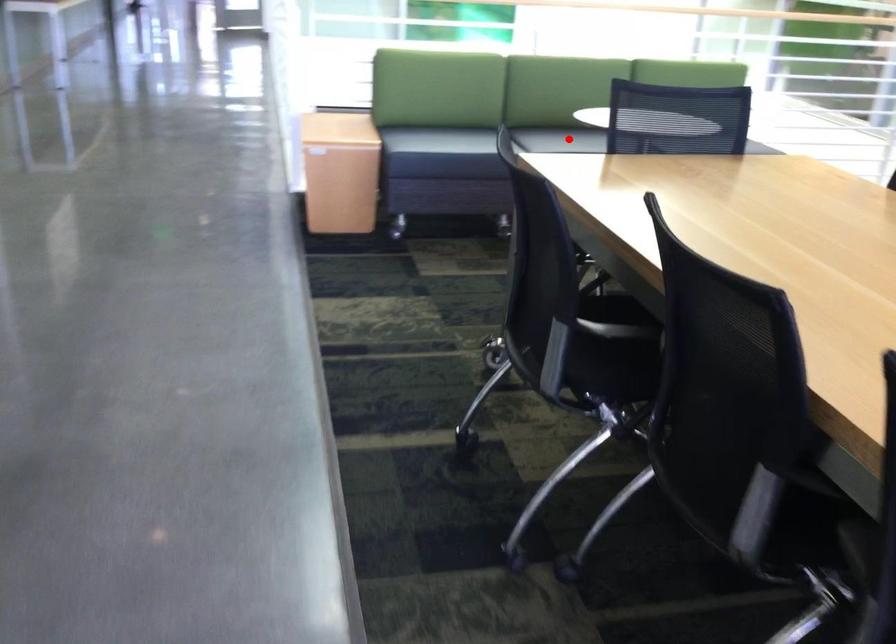
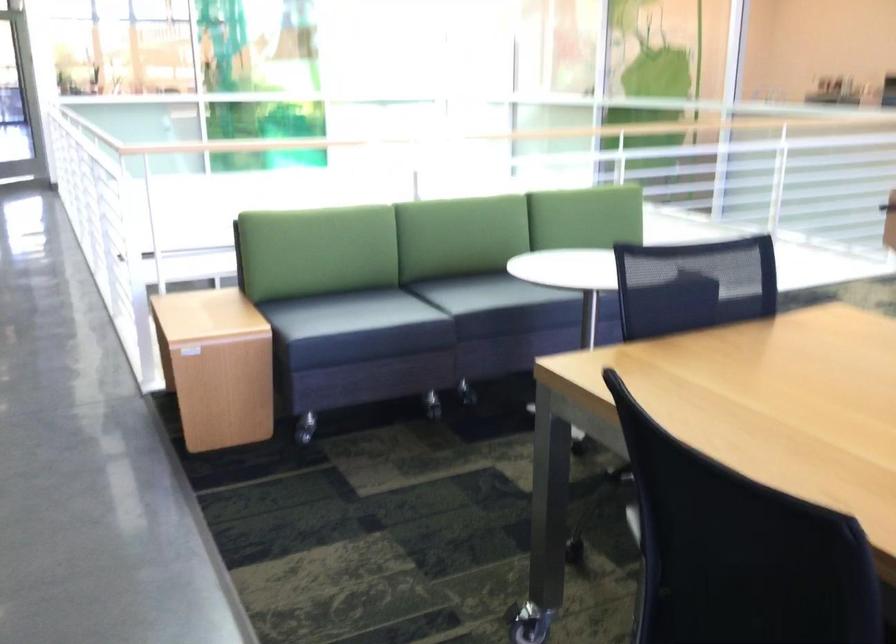
Question: I am providing you with two images of the same scene from different viewpoints. Given a red point in image1, look at the same physical point in image2. Is it:

Choices:
 (A) Closer to the viewpoint
 (B) Farther from the viewpoint

Answer: (A)